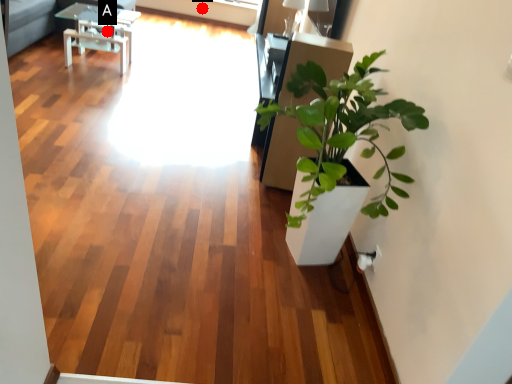
Question: Two points are circled on the image, labeled by A and B beside each circle. Among these points, which one is nearest to the camera?

Choices:
 (A) A is closer
 (B) B is closer

Answer: (A)